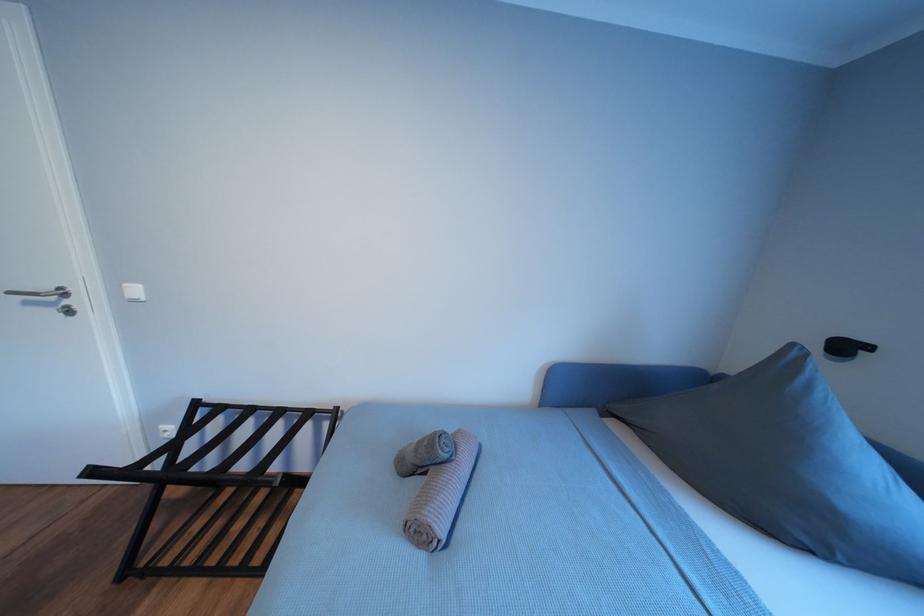
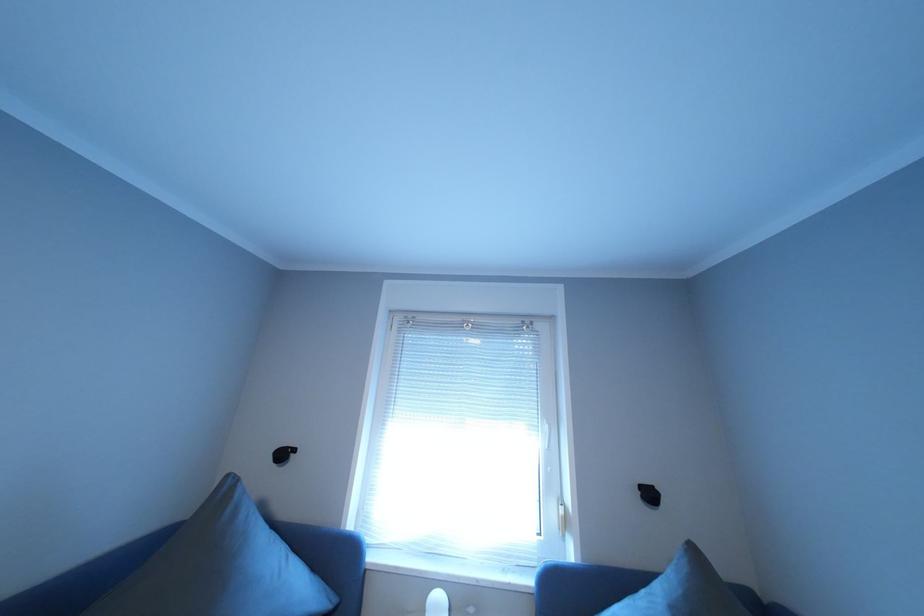
Question: The camera is either moving clockwise (left) or counter-clockwise (right) around the object. The first image is from the beginning of the video and the second image is from the end. Is the camera moving left or right when shooting the video?

Choices:
 (A) Left
 (B) Right

Answer: (A)